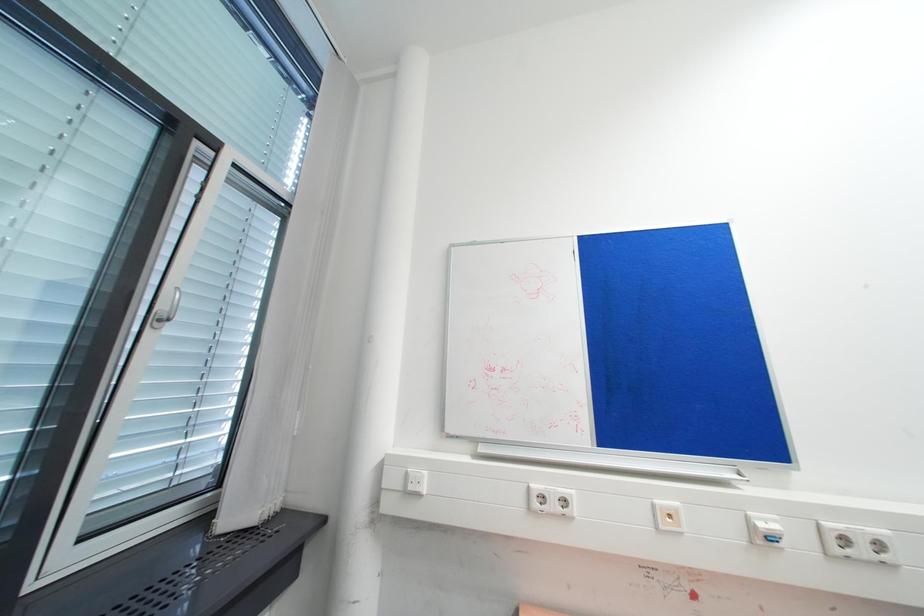
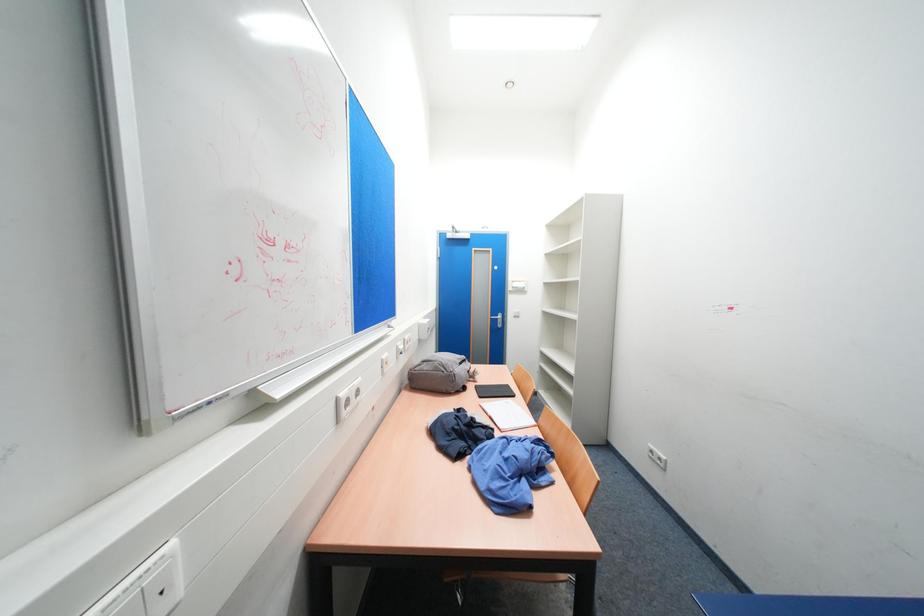
Question: The first image is from the beginning of the video and the second image is from the end. How did the camera likely rotate when shooting the video?

Choices:
 (A) Left
 (B) Right
 (C) Up
 (D) Down

Answer: (B)